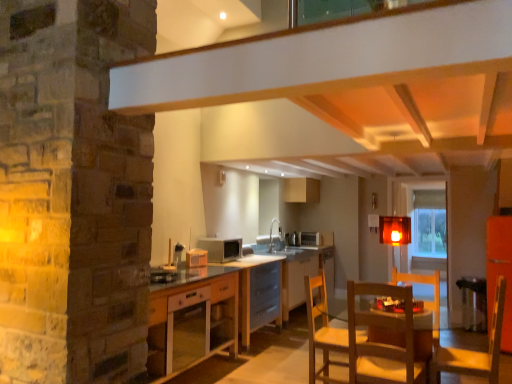
Question: Is point (463, 297) closer or farther from the camera than point (151, 359)?

Choices:
 (A) farther
 (B) closer

Answer: (A)

Question: Is metallic silver bar stool at lower right situated inside wooden cabinet at lower center or outside?

Choices:
 (A) inside
 (B) outside

Answer: (B)

Question: Which object is the farthest from the light brown wooden chair at lower right?

Choices:
 (A) wooden table at center, placed as the 1th table when sorted from back to front
 (B) matte white microwave at center
 (C) wooden cabinet at lower center
 (D) translucent amber cube at center
 (E) wooden table at center, placed as the first table when sorted from front to back

Answer: (A)

Question: Which is farther from the light brown wooden chair at lower right?

Choices:
 (A) matte white microwave at center
 (B) wooden table at center, which ranks as the second table in back-to-front order
 (C) translucent amber cube at center
 (D) wooden table at center, which ranks as the second table in front-to-back order
 (E) metallic silver bar stool at lower right

Answer: (D)